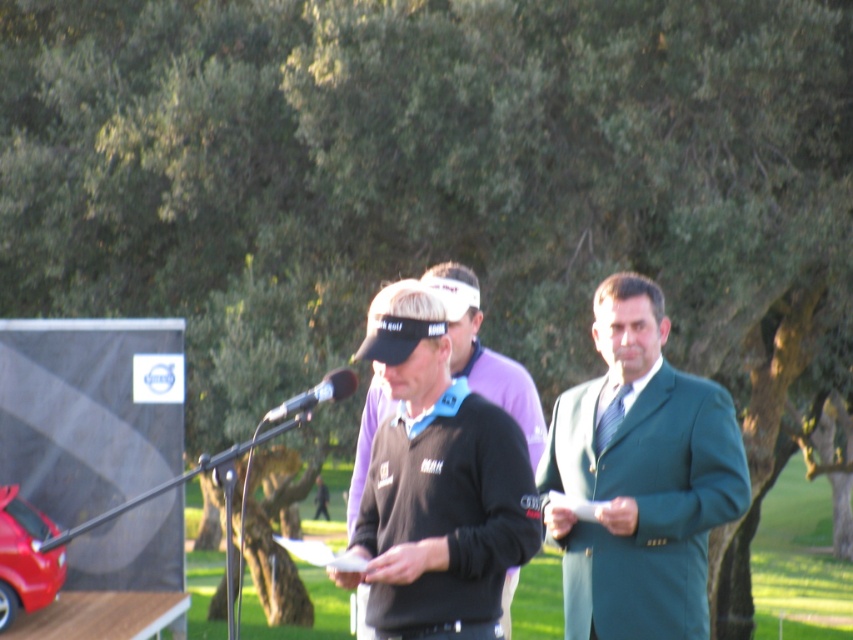
You are a photographer positioned to capture the speaker at the event. You notice the black matte jacket at center and the black metallic microphone at center in your frame. Which object appears taller in the photo?

The black matte jacket at center appears taller than the black metallic microphone at center in the photo.

You are a stagehand setting up for a presentation at a golf event. You need to ensure there is enough space between the green wool suit at center and the black metallic microphone at center for the presenter to move comfortably. The recommended minimum distance is 1.4 meters. Can the presenter move comfortably between them?

The green wool suit at center and black metallic microphone at center are 1.50 meters apart, which exceeds the recommended minimum distance of 1.4 meters. The presenter can move comfortably between them.